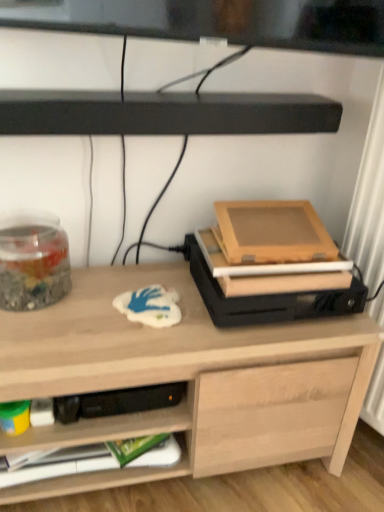
Identify the location of free space in front of transparent glass jar at left. The height and width of the screenshot is (512, 384). (38, 334).